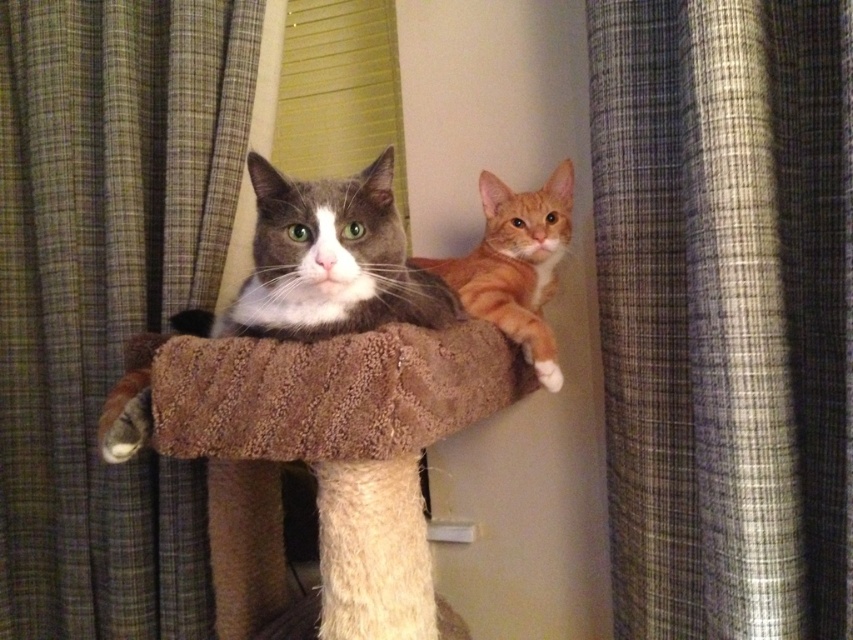
Which is more to the right, gray-white fur cat at center or gray and white plush cat at center?

Positioned to the right is gray and white plush cat at center.

Does gray-white fur cat at center have a lesser height compared to gray and white plush cat at center?

In fact, gray-white fur cat at center may be taller than gray and white plush cat at center.

Is point (210, 317) positioned before point (248, 298)?

No, (210, 317) is further to viewer.

Identify the location of gray-white fur cat at center. This screenshot has height=640, width=853. (326, 260).

Is point (349, 244) farther from camera compared to point (494, 269)?

No, (349, 244) is in front of (494, 269).

Does gray-white fur cat at center have a lesser height compared to orange fur cat at center?

In fact, gray-white fur cat at center may be taller than orange fur cat at center.

Is point (433, 310) closer to viewer compared to point (479, 248)?

That is True.

This screenshot has width=853, height=640. In order to click on gray-white fur cat at center in this screenshot , I will do `click(326, 260)`.

Does green plaid curtain at left appear on the left side of gray and white plush cat at center?

Indeed, green plaid curtain at left is positioned on the left side of gray and white plush cat at center.

From the picture: Does green plaid curtain at left appear under gray and white plush cat at center?

Indeed, green plaid curtain at left is positioned under gray and white plush cat at center.

You are a GUI agent. You are given a task and a screenshot of the screen. Output one action in this format:
    pyautogui.click(x=<x>, y=<y>)
    Task: Click on the green plaid curtain at left
    The width and height of the screenshot is (853, 640).
    Given the screenshot: What is the action you would take?
    pyautogui.click(x=107, y=294)

Find the location of a particular element. The image size is (853, 640). green plaid curtain at left is located at coordinates (107, 294).